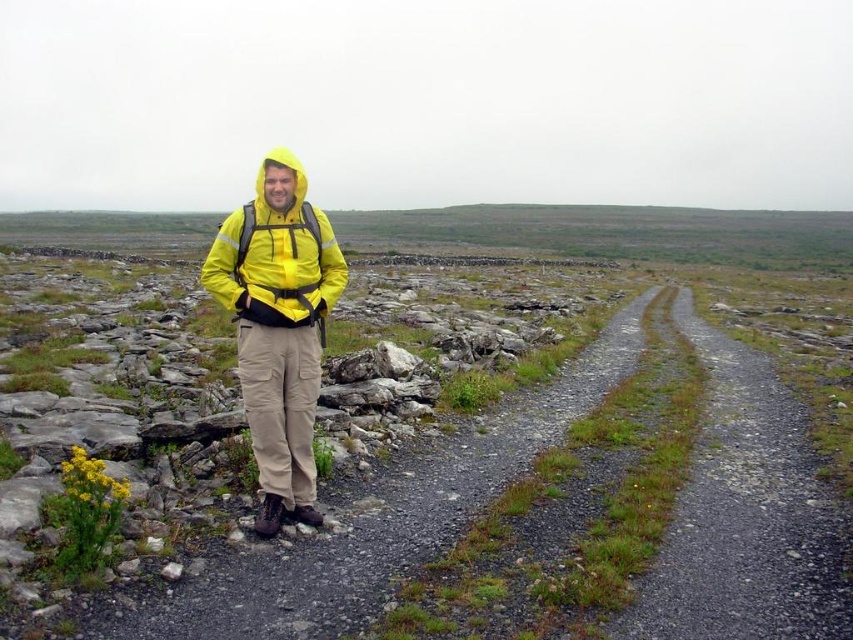
Wait, the objects are the same? The user might have made a mistake here. Let me check the input again. The Objects list has two entries that are almost identical except for the word order. The first is yellow matte jacket at center and the second is matte yellow jacket at center. Since they are the same object but with swapped adjectives, maybe they are duplicates. But according to the rules, I have to use all object labels exactly as given. Hmm, perhaps the user intended them as separate objects? Maybe the

The problem seems to arise from duplicate or near duplicate object entries. Since both objects are described as yellow matte jackets at the center but with adjective order swapped, they likely refer to the same item. However, following the rules strictly, each object label must be used exactly as provided. This might require crafting a question that addresses both entries despite their similarity, possibly pointing out the discrepancy or treating them as separate entities. However, since the Objects list is

You are a hiker planning to walk along the path in the rugged landscape. You notice two points marked on the path. The first point is at coordinates point (265,189) and the second point is at point (308,216). Which point is closer to your current position as you stand at the starting point of the path?

Point (265,189) is closer to the camera than point (308,216), so the first point is closer to your current position.